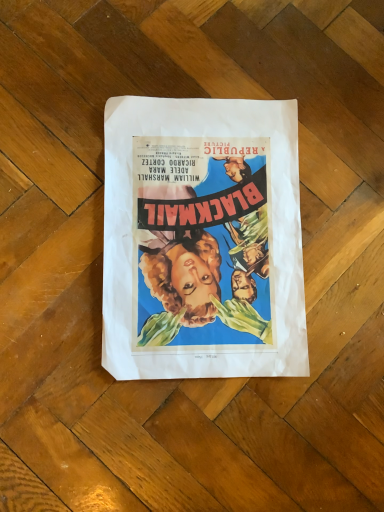
Identify the location of free space above matte paper poster at center (from a real-world perspective). (218, 233).